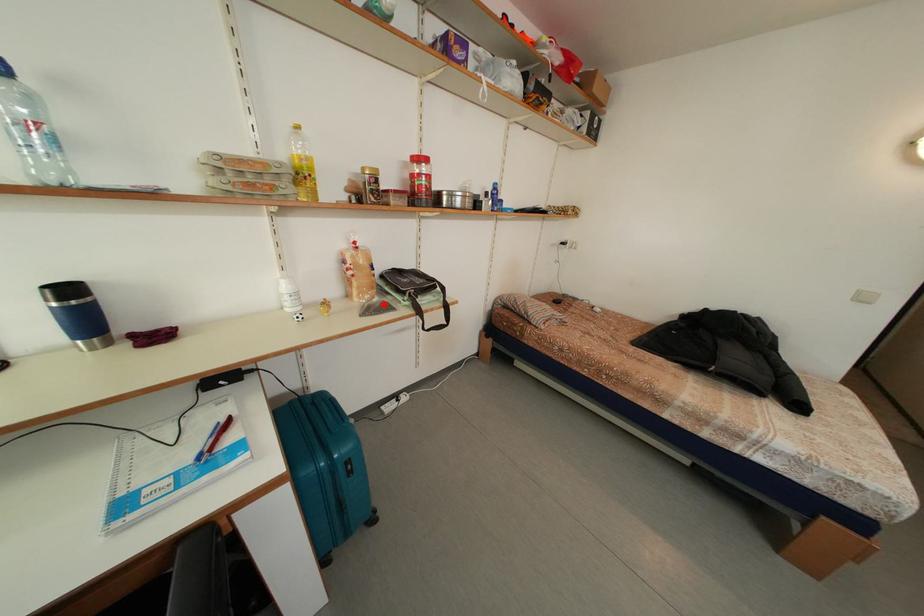
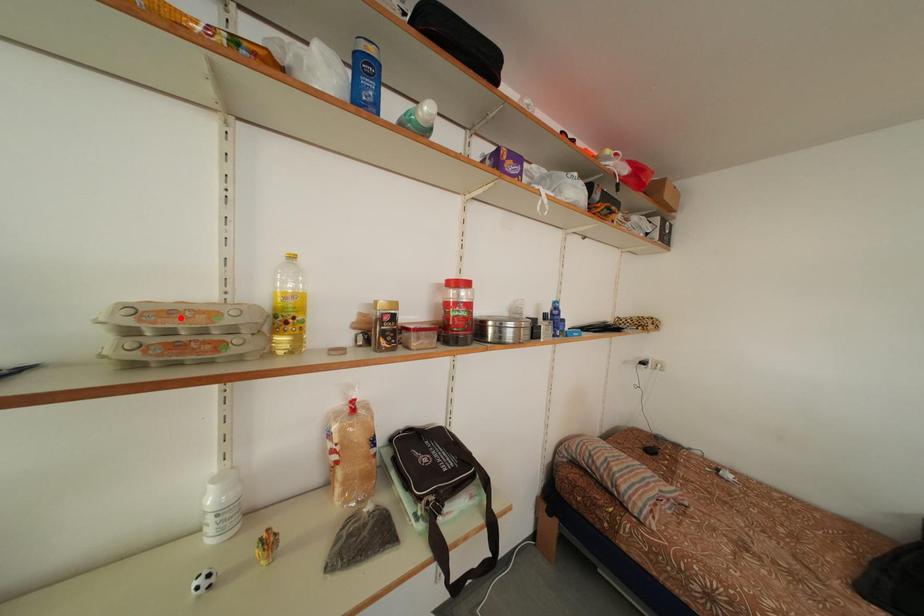
I am providing you with two images of the same scene from different viewpoints. A red point is marked on the first image and another point is marked on the second image. Is the marked point in image1 the same physical position as the marked point in image2?

No